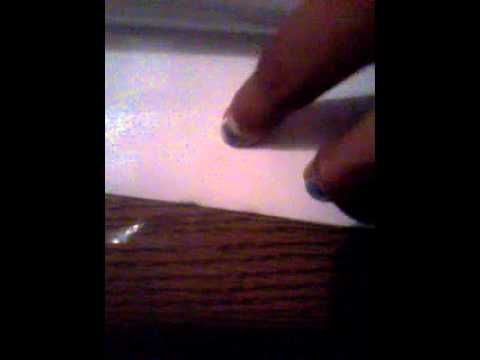
Image resolution: width=480 pixels, height=360 pixels. In order to click on brown table in this screenshot , I will do `click(229, 280)`.